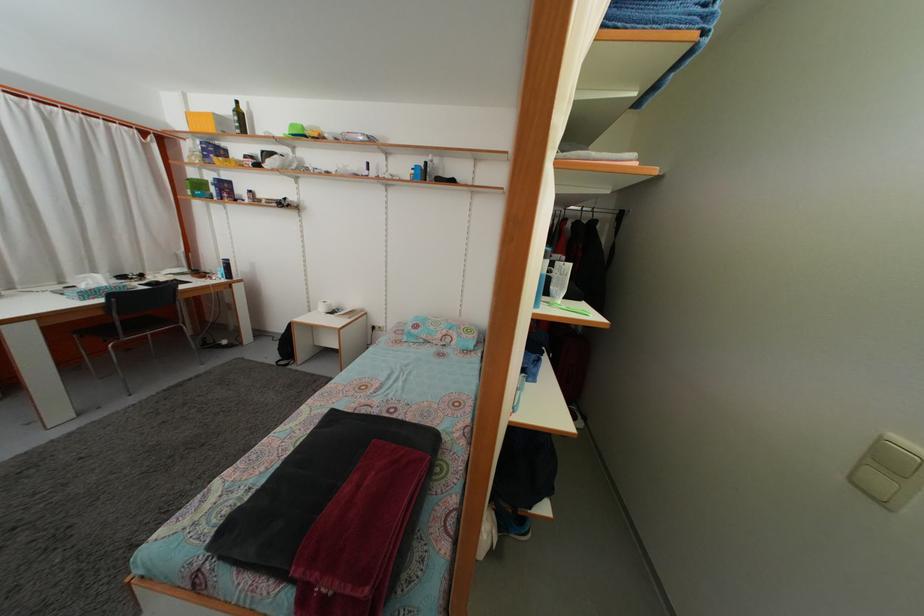
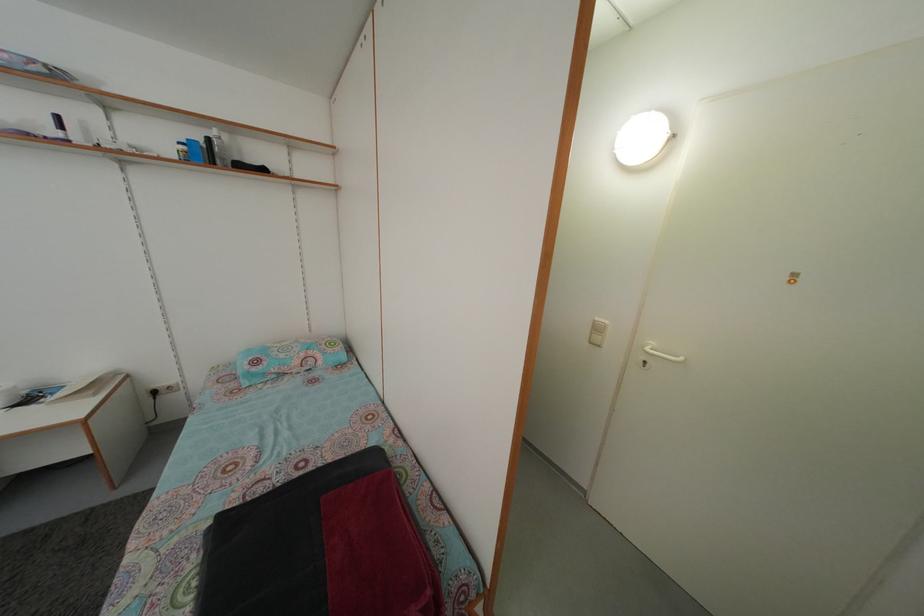
Locate, in the second image, the point that corresponds to point (432, 171) in the first image.

(214, 148)